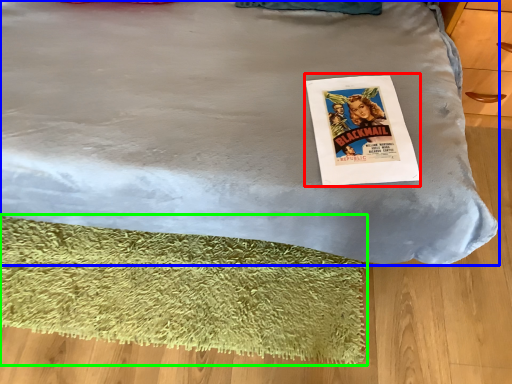
Question: Considering the real-world distances, which object is closest to magazine (highlighted by a red box)? bed (highlighted by a blue box) or mat (highlighted by a green box).

Choices:
 (A) bed
 (B) mat

Answer: (A)